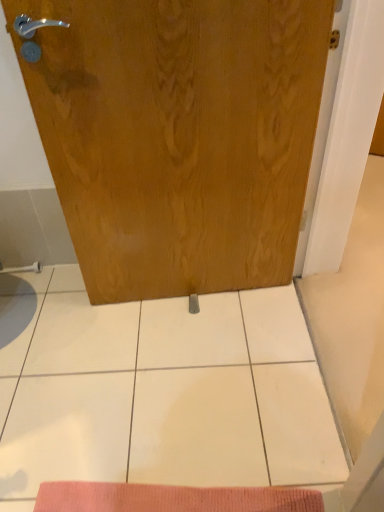
At what (x,y) coordinates should I click in order to perform the action: click on free spot to the left of wooden door at center. Please return your answer as a coordinate pair (x, y). Looking at the image, I should click on (75, 330).